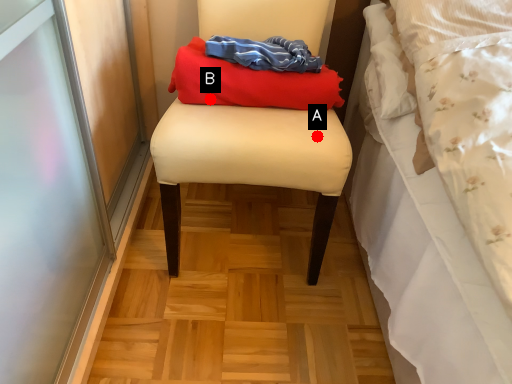
Question: Two points are circled on the image, labeled by A and B beside each circle. Which point appears closest to the camera in this image?

Choices:
 (A) A is closer
 (B) B is closer

Answer: (A)